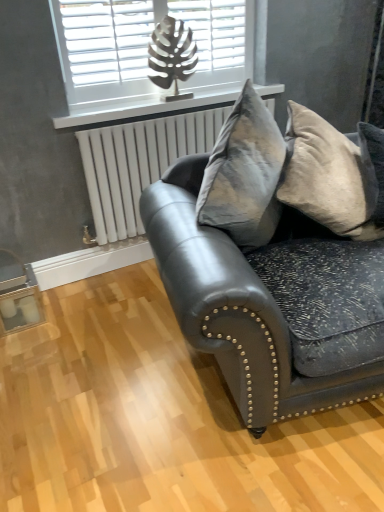
Question: Is white plastic radiator at upper center aimed at white matte window at upper center?

Choices:
 (A) yes
 (B) no

Answer: (B)

Question: Is white plastic radiator at upper center closer to camera compared to white matte window at upper center?

Choices:
 (A) no
 (B) yes

Answer: (A)

Question: Is white plastic radiator at upper center shorter than white matte window at upper center?

Choices:
 (A) yes
 (B) no

Answer: (A)

Question: Is white plastic radiator at upper center bigger than white matte window at upper center?

Choices:
 (A) yes
 (B) no

Answer: (B)

Question: Does white plastic radiator at upper center touch white matte window at upper center?

Choices:
 (A) no
 (B) yes

Answer: (A)

Question: From a real-world perspective, is white plastic radiator at upper center beneath white matte window at upper center?

Choices:
 (A) yes
 (B) no

Answer: (A)

Question: From a real-world perspective, does white matte window at upper center sit lower than velvet gray pillow at right?

Choices:
 (A) no
 (B) yes

Answer: (A)

Question: From the image's perspective, is white matte window at upper center beneath velvet gray pillow at right?

Choices:
 (A) yes
 (B) no

Answer: (B)

Question: Is white matte window at upper center in contact with velvet gray pillow at right?

Choices:
 (A) yes
 (B) no

Answer: (B)

Question: Does white matte window at upper center come behind velvet gray pillow at right?

Choices:
 (A) yes
 (B) no

Answer: (A)

Question: Is white matte window at upper center positioned with its back to velvet gray pillow at right?

Choices:
 (A) no
 (B) yes

Answer: (A)

Question: Considering the relative sizes of white matte window at upper center and velvet gray pillow at right in the image provided, is white matte window at upper center wider than velvet gray pillow at right?

Choices:
 (A) no
 (B) yes

Answer: (A)

Question: Can you see white matte window at upper center touching matte black leather couch at center?

Choices:
 (A) no
 (B) yes

Answer: (A)